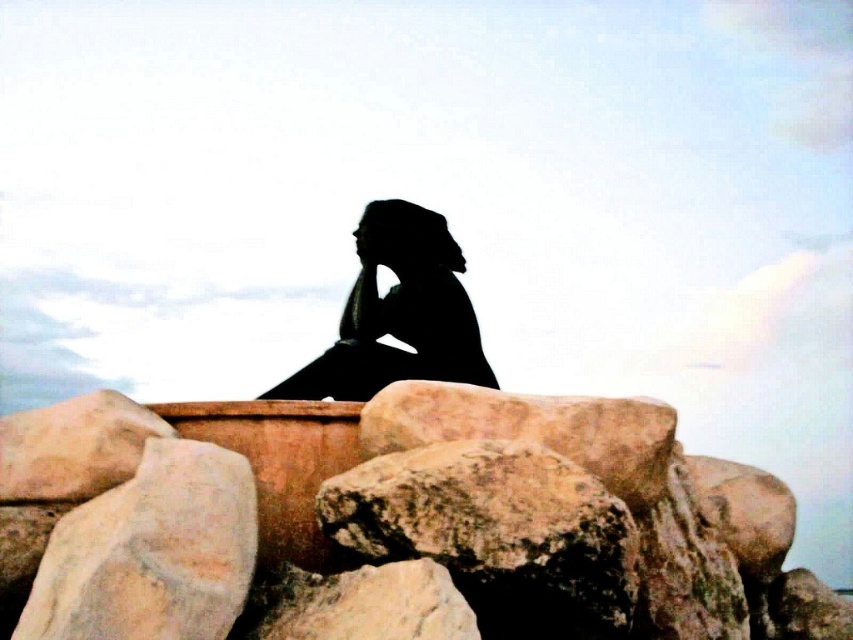
Question: Which point is closer to the camera?

Choices:
 (A) (434, 248)
 (B) (231, 552)

Answer: (B)

Question: Which of the following is the farthest from the observer?

Choices:
 (A) rustic stone at lower left
 (B) black matte figure at center

Answer: (B)

Question: Does rustic stone at lower left appear on the right side of black matte figure at center?

Choices:
 (A) yes
 (B) no

Answer: (B)

Question: Where is rustic stone at lower left located in relation to black matte figure at center in the image?

Choices:
 (A) left
 (B) right

Answer: (A)

Question: In this image, where is rustic stone at lower left located relative to black matte figure at center?

Choices:
 (A) below
 (B) above

Answer: (A)